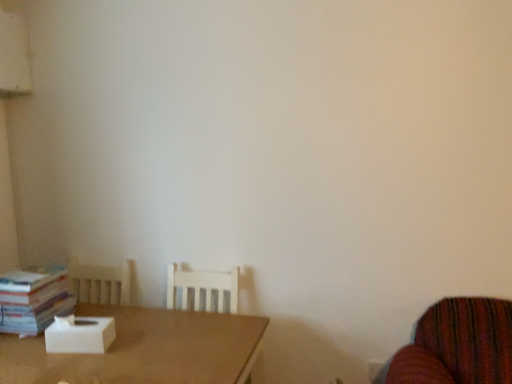
Question: Is white paper book at left at the left side of white cardboard box at center?

Choices:
 (A) no
 (B) yes

Answer: (B)

Question: Would you consider white paper book at left to be distant from white cardboard box at center?

Choices:
 (A) no
 (B) yes

Answer: (A)

Question: From a real-world perspective, is white paper book at left located beneath white cardboard box at center?

Choices:
 (A) no
 (B) yes

Answer: (A)

Question: Does white paper book at left have a greater height compared to white cardboard box at center?

Choices:
 (A) yes
 (B) no

Answer: (A)

Question: Is white paper book at left positioned with its back to white cardboard box at center?

Choices:
 (A) yes
 (B) no

Answer: (B)

Question: Is white paper book at left touching white cardboard box at center?

Choices:
 (A) no
 (B) yes

Answer: (A)

Question: Considering the relative sizes of white paper book at left and brown matte table at lower left in the image provided, is white paper book at left taller than brown matte table at lower left?

Choices:
 (A) no
 (B) yes

Answer: (A)

Question: Is white paper book at left wider than brown matte table at lower left?

Choices:
 (A) no
 (B) yes

Answer: (A)

Question: From a real-world perspective, is white paper book at left on brown matte table at lower left?

Choices:
 (A) yes
 (B) no

Answer: (A)

Question: Considering the relative positions of white paper book at left and brown matte table at lower left in the image provided, is white paper book at left to the left of brown matte table at lower left from the viewer's perspective?

Choices:
 (A) yes
 (B) no

Answer: (A)

Question: Is brown matte table at lower left at the back of white paper book at left?

Choices:
 (A) yes
 (B) no

Answer: (B)

Question: Is white paper book at left oriented towards brown matte table at lower left?

Choices:
 (A) no
 (B) yes

Answer: (A)

Question: Is white cardboard box at center oriented away from brown matte table at lower left?

Choices:
 (A) yes
 (B) no

Answer: (B)